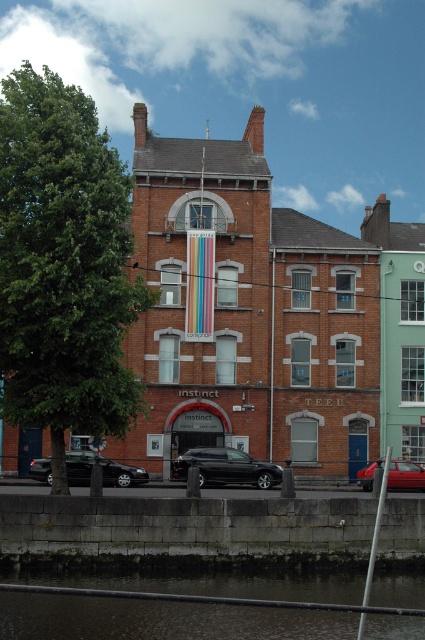
Question: Which object appears farthest from the camera in this image?

Choices:
 (A) shiny red car at lower right
 (B) shiny black sedan at lower left

Answer: (B)

Question: Is dark water at lower center thinner than shiny black sedan at lower left?

Choices:
 (A) no
 (B) yes

Answer: (A)

Question: Is dark water at lower center to the right of shiny red car at lower right from the viewer's perspective?

Choices:
 (A) yes
 (B) no

Answer: (B)

Question: Does dark water at lower center appear over shiny black car at lower center?

Choices:
 (A) no
 (B) yes

Answer: (A)

Question: Among these objects, which one is nearest to the camera?

Choices:
 (A) shiny red car at lower right
 (B) shiny black sedan at lower left
 (C) dark water at lower center

Answer: (C)

Question: Which object is closer to the camera taking this photo?

Choices:
 (A) shiny red car at lower right
 (B) dark water at lower center

Answer: (B)